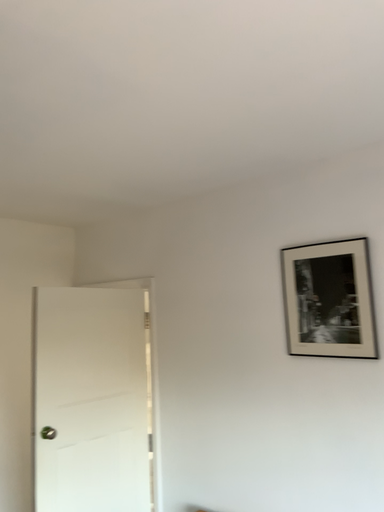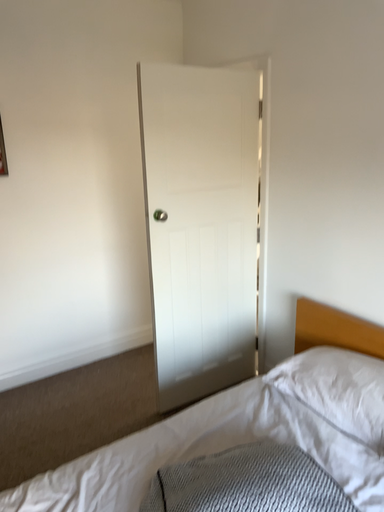
Question: How did the camera likely rotate when shooting the video?

Choices:
 (A) rotated right
 (B) rotated left

Answer: (B)